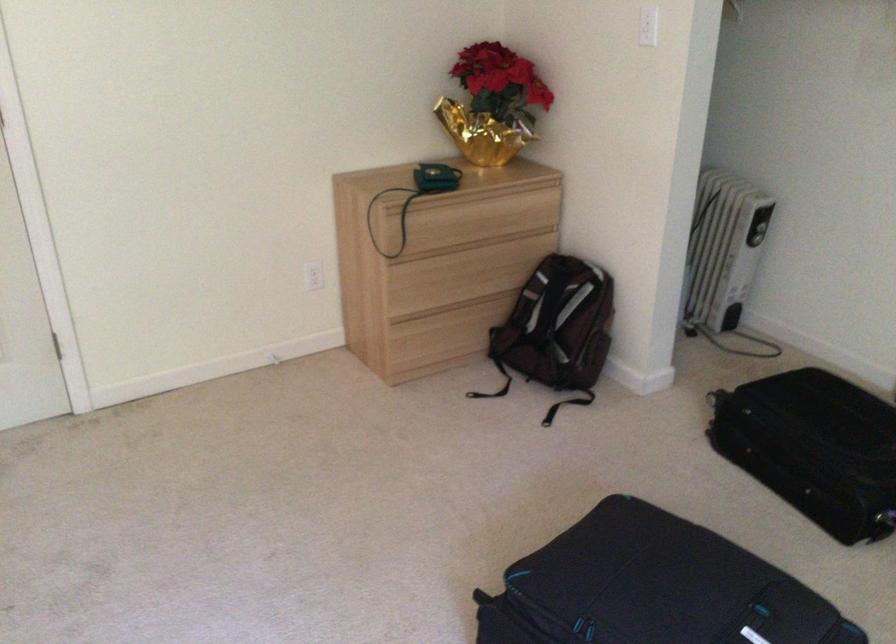
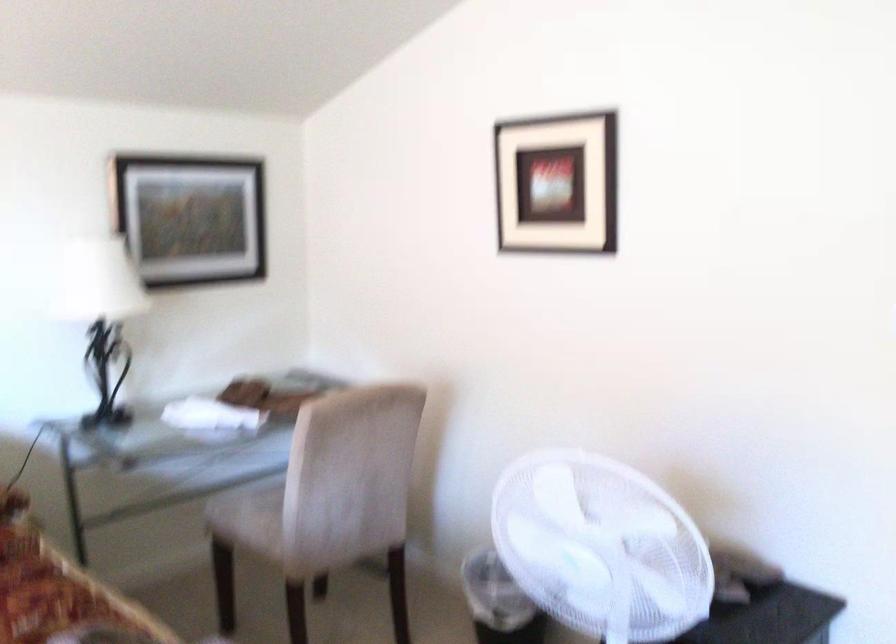
Question: Based on the continuous images, in which direction is the camera rotating? Reply with the corresponding letter.

Choices:
 (A) Left
 (B) Right
 (C) Up
 (D) Down

Answer: (A)